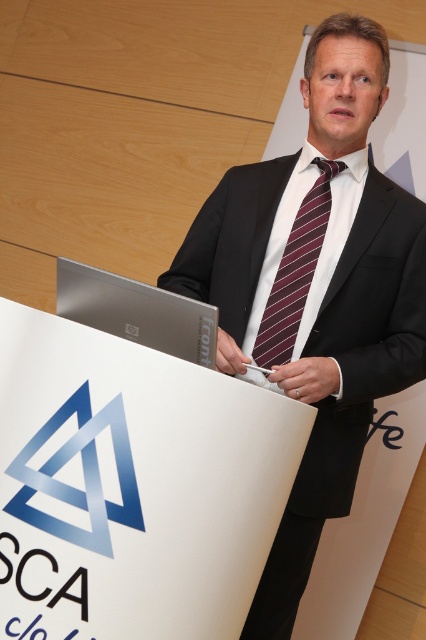
You are an event organizer setting up a stage. You have a white smooth podium at center and a maroon striped tie at center. Which object is wider?

The white smooth podium at center is wider than the maroon striped tie at center.

You are an event organizer who needs to ensure that the black silk suit at center is visible to all attendees. Considering the white smooth podium at center, which object is narrower and might block the view of the other?

The white smooth podium at center is narrower than the black silk suit at center, so it might block the view of the black silk suit at center if positioned in front of it.